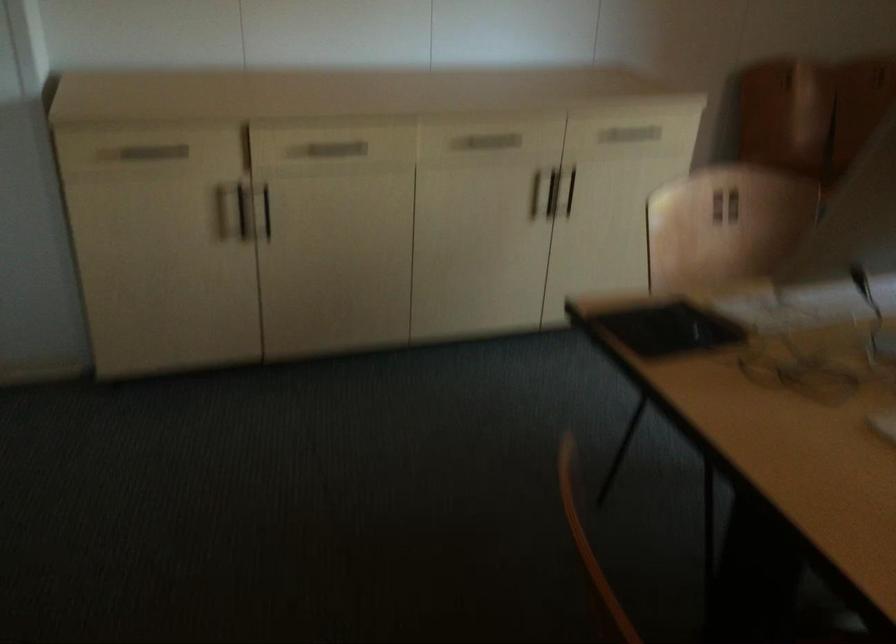
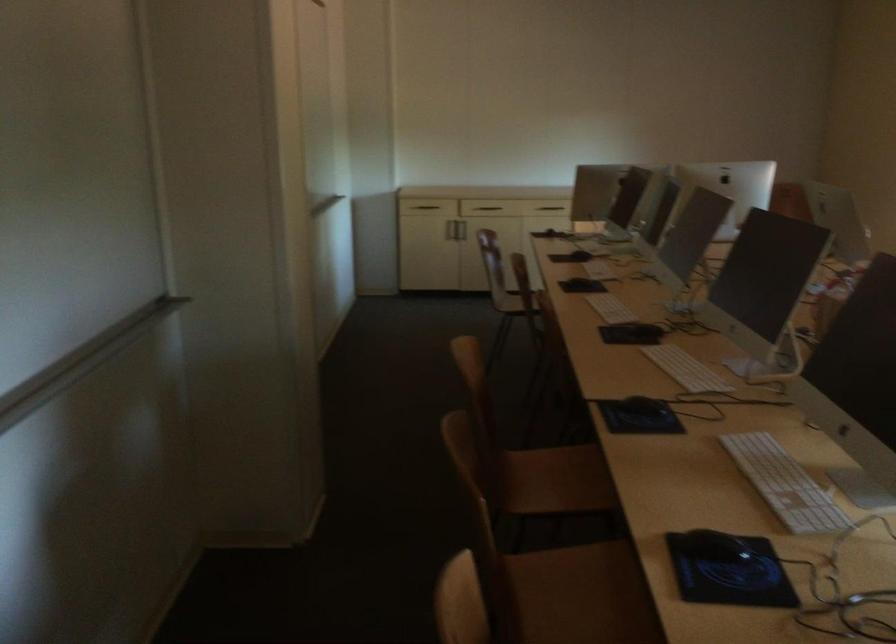
Question: I am providing you with two images of the same scene from different viewpoints. After the viewpoint changes to image2, which objects are now occluded?

Choices:
 (A) vertical cabinet handle
 (B) black computer mouse
 (C) dark drawer handle
 (D) shutter door lock

Answer: (A)